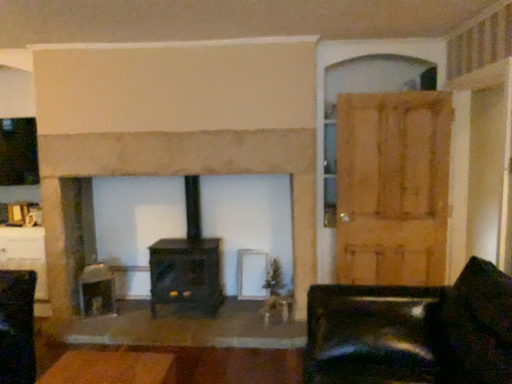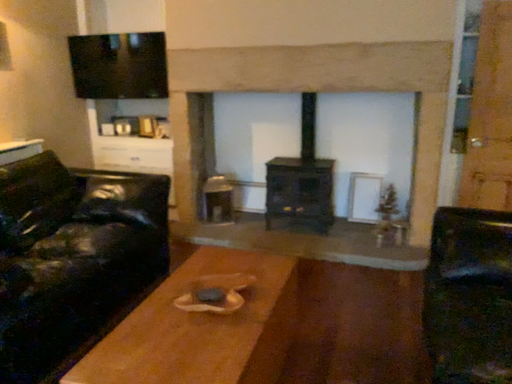
Question: Which way did the camera rotate in the video?

Choices:
 (A) rotated downward
 (B) rotated upward

Answer: (A)